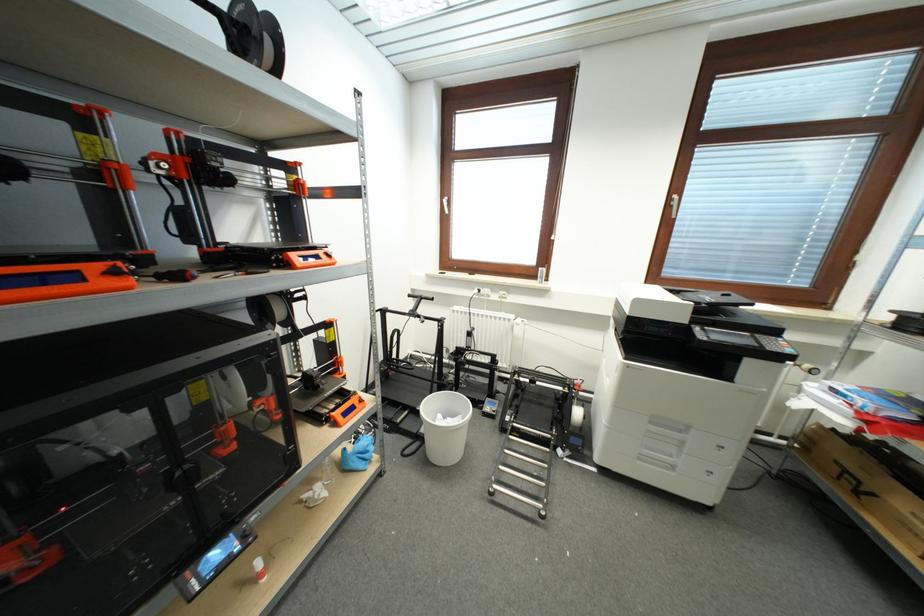
Find where to turn the white window handle. Please return your answer as a coordinate pair (x, y).

(450, 205)